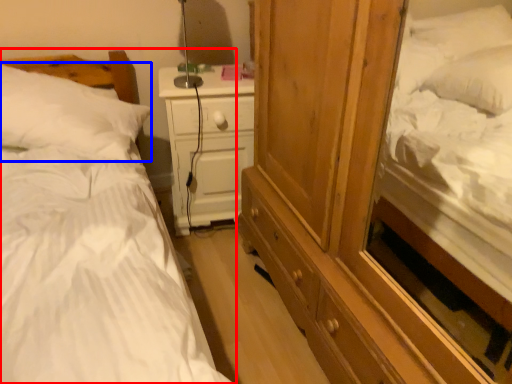
Question: Among these objects, which one is nearest to the camera, bed (highlighted by a red box) or pillow (highlighted by a blue box)?

Choices:
 (A) bed
 (B) pillow

Answer: (A)